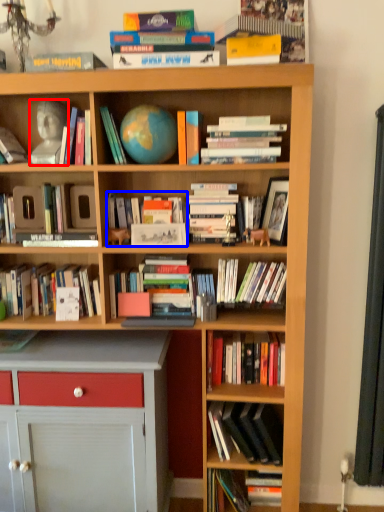
Question: Which point is further to the camera, person (highlighted by a red box) or book (highlighted by a blue box)?

Choices:
 (A) person
 (B) book

Answer: (B)